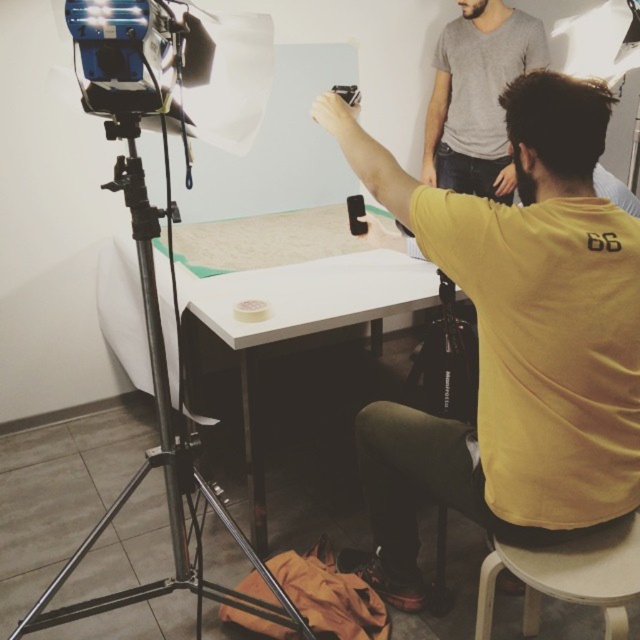
Which of these two, yellow matte shirt at center or white plastic stool at lower right, stands taller?

With more height is yellow matte shirt at center.

Is point (540, 189) positioned before point (557, 584)?

That is False.

This screenshot has height=640, width=640. What are the coordinates of `yellow matte shirt at center` in the screenshot? It's located at (515, 339).

Which is above, black metal tripod at left or white plastic stool at lower right?

black metal tripod at left is above.

Which is behind, point (54, 609) or point (589, 576)?

The point (54, 609) is more distant.

Image resolution: width=640 pixels, height=640 pixels. I want to click on black metal tripod at left, so click(x=161, y=442).

Does point (563, 272) come behind point (161, 413)?

No, it is in front of (161, 413).

Which is more to the left, yellow matte shirt at center or black metal tripod at left?

black metal tripod at left is more to the left.

Does point (397, 412) come in front of point (129, 124)?

No, it is behind (129, 124).

Find the location of a particular element. The image size is (640, 640). yellow matte shirt at center is located at coordinates (515, 339).